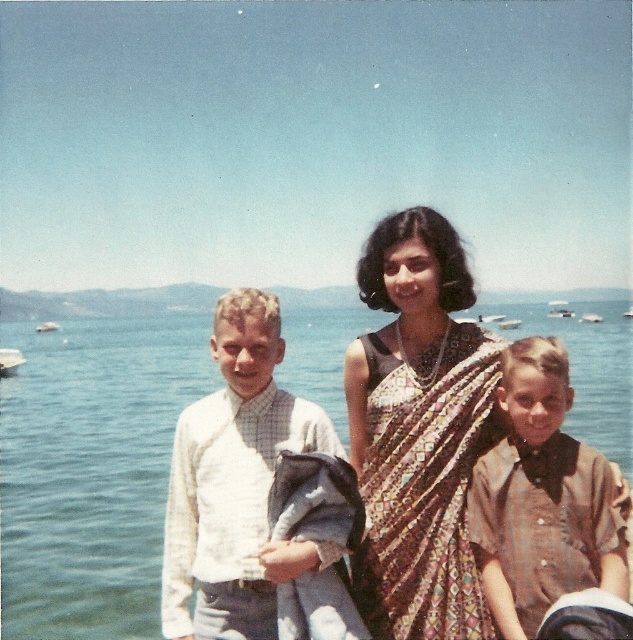
You are organizing a clothing donation drive and need to categorize shirts by size. You have a white cotton shirt at left and a brown cotton shirt at lower right. Which shirt should you place in the large size bin?

The white cotton shirt at left should be placed in the large size bin because it has a larger size compared to the brown cotton shirt at lower right.

You are standing at the point labeled as point (66, 324). If you look towards the viewer, which direction should you turn to face the direction you came from?

Since the point (66, 324) is 268.93 meters away from the viewer, you should turn around 180 degrees to face the direction you came from.